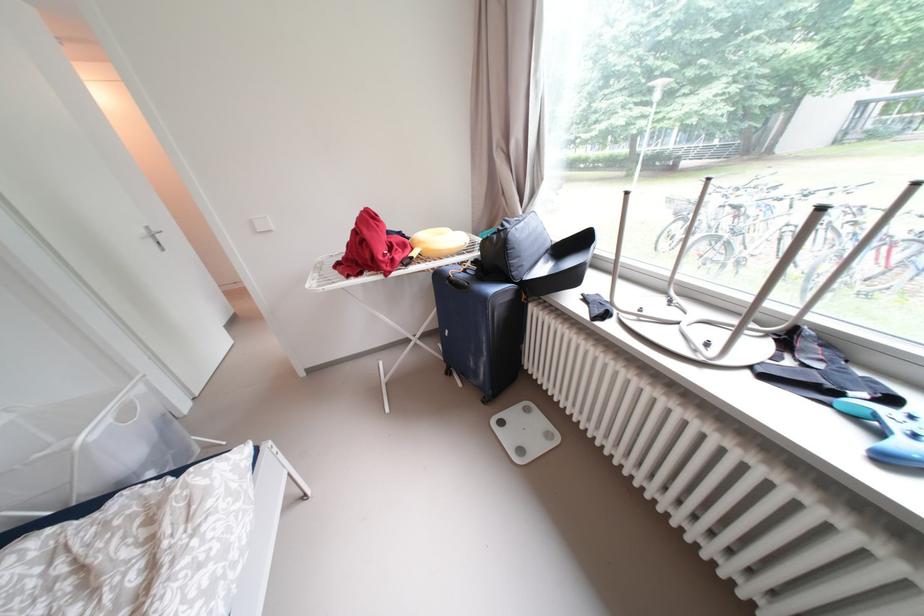
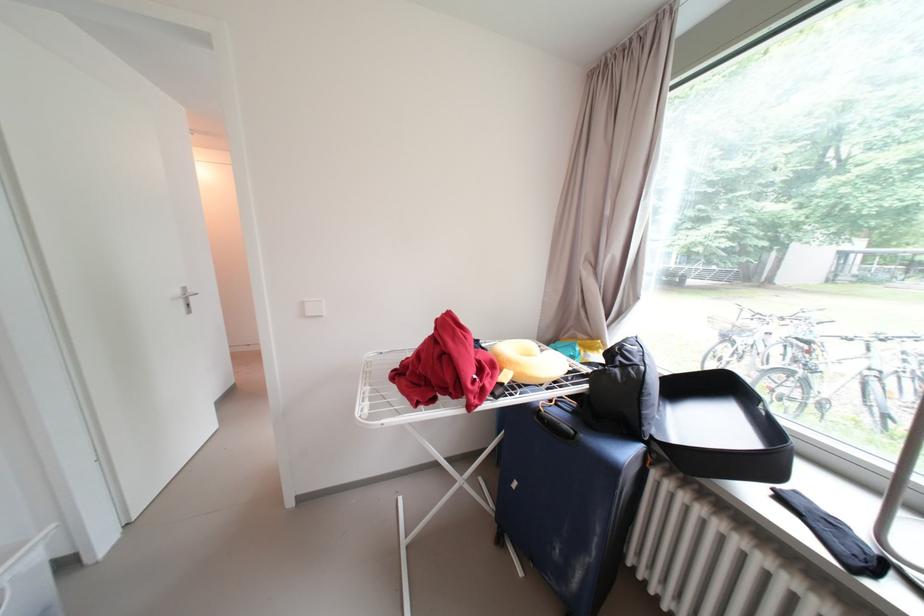
The point at [526,272] is marked in the first image. Where is the corresponding point in the second image?

(658, 424)